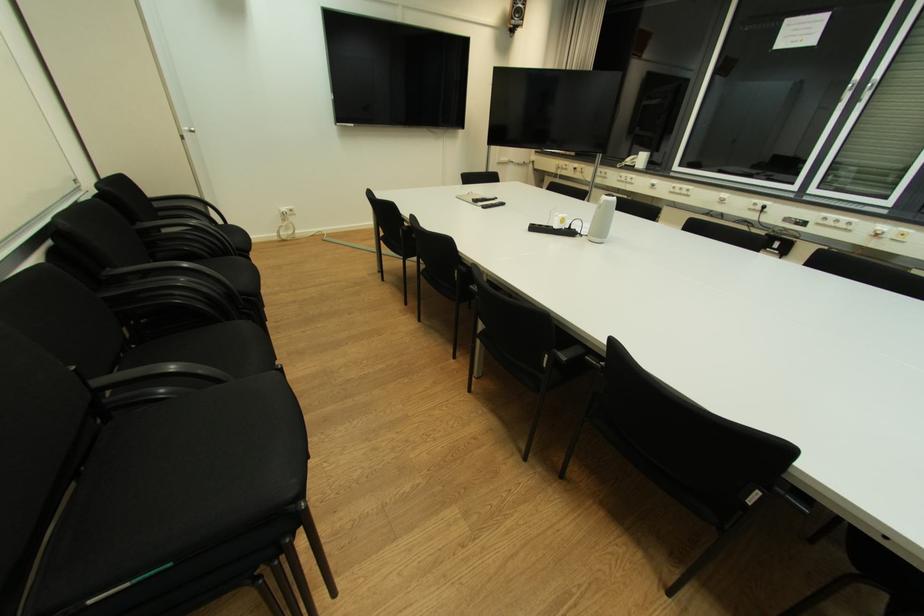
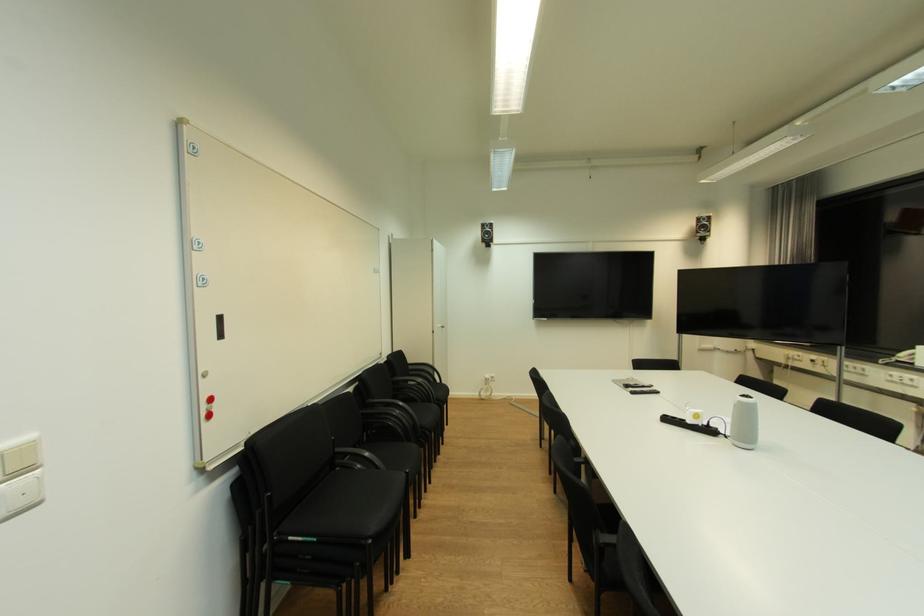
In the second image, find the point that corresponds to pixel 540 229 in the first image.

(674, 421)